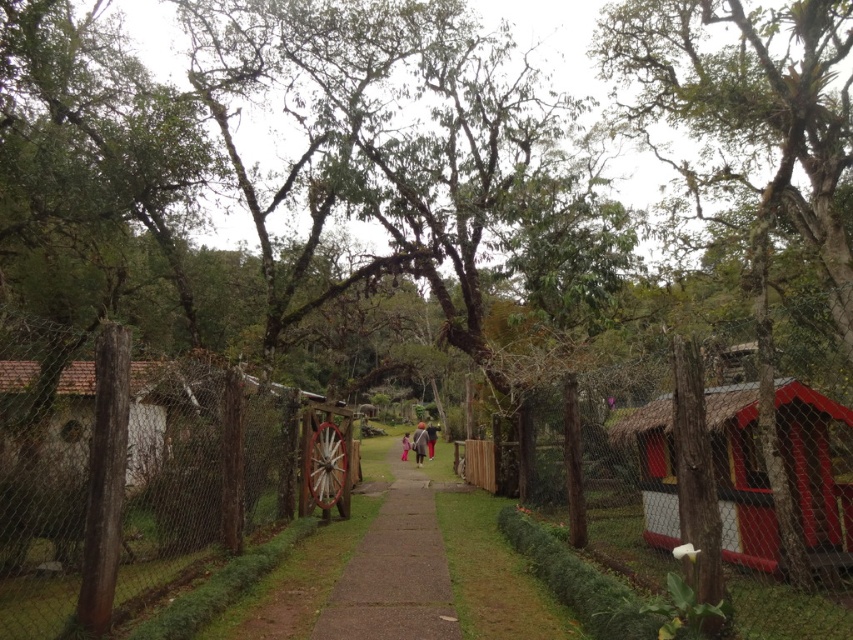
You are a delivery person with a cart that is 5 meters wide. You need to move through the path between the wire mesh fence at center and the wooden gate on the left. Can your cart fit through the space between them?

The space between the wire mesh fence at center and the wooden gate on the left is 5.43 meters, which is wider than your 5 meters wide cart. Therefore, your cart can fit through the space between them.

You are standing at the starting point of the paved pathway and want to reach the wooden fence at center. Which direction should you walk to get there?

Since the wooden fence at center is located at coordinates 0.742 on the x axis and 0.163 on the y axis, you should walk forward along the pathway towards the center to reach it.